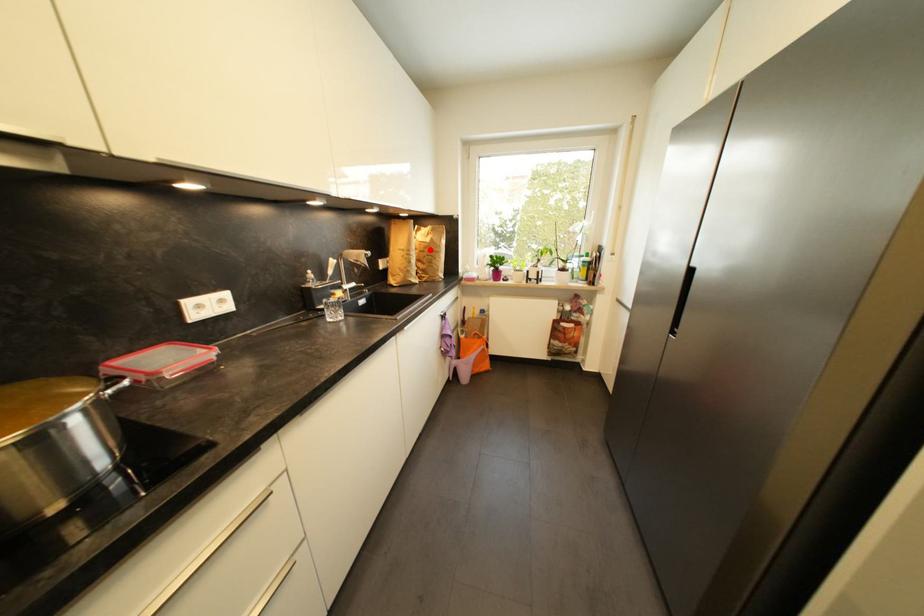
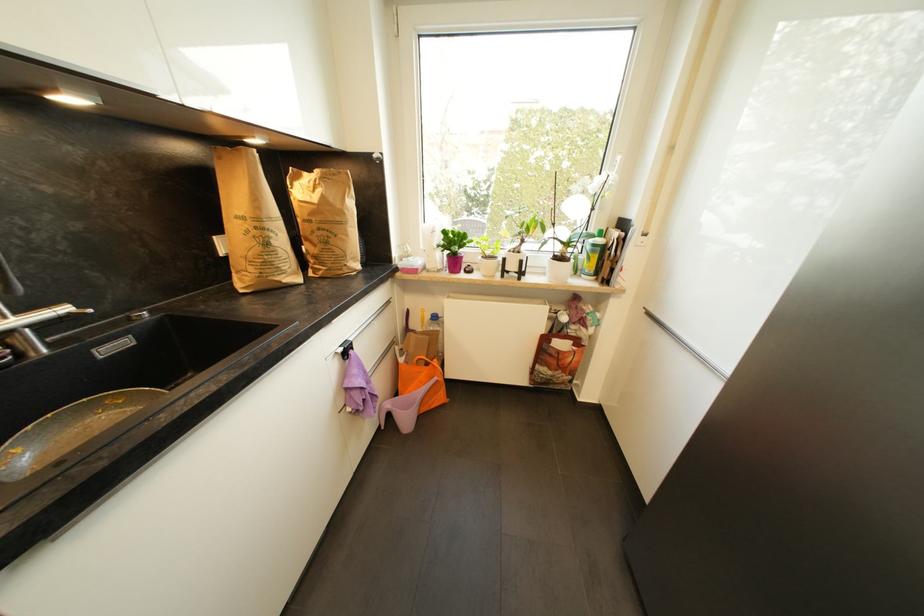
The point at the highlighted location is marked in the first image. Where is the corresponding point in the second image?

(317, 216)